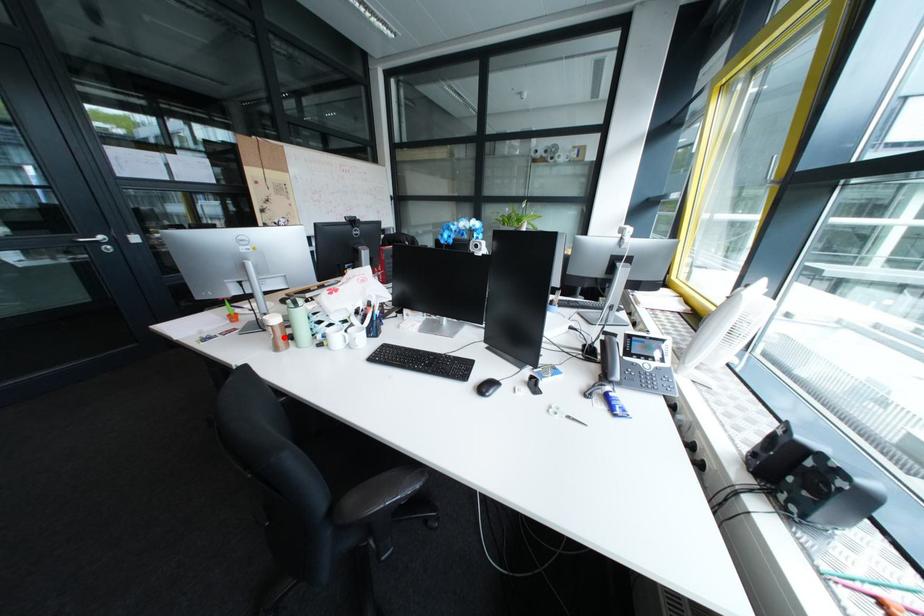
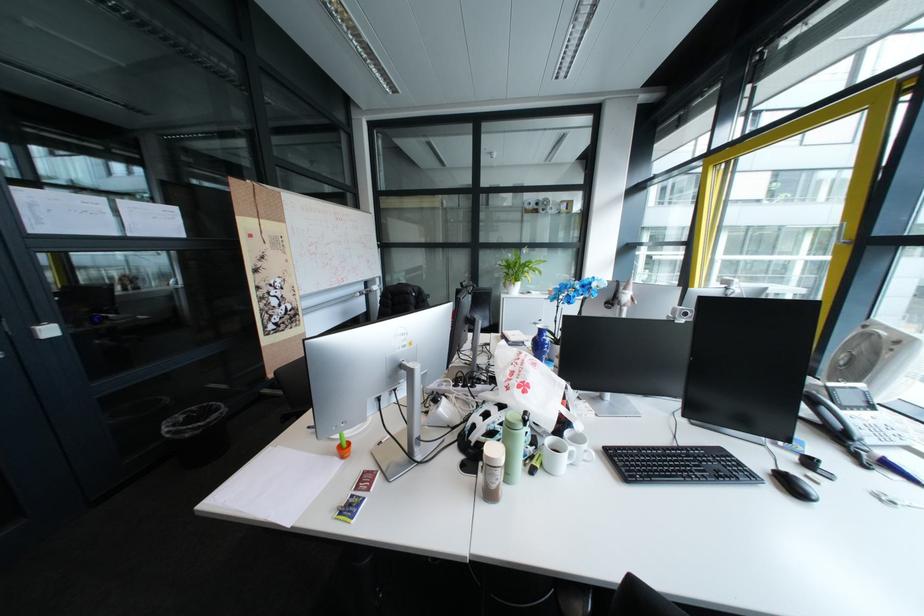
The point at the highlighted location is marked in the first image. Where is the corresponding point in the second image?

(507, 484)